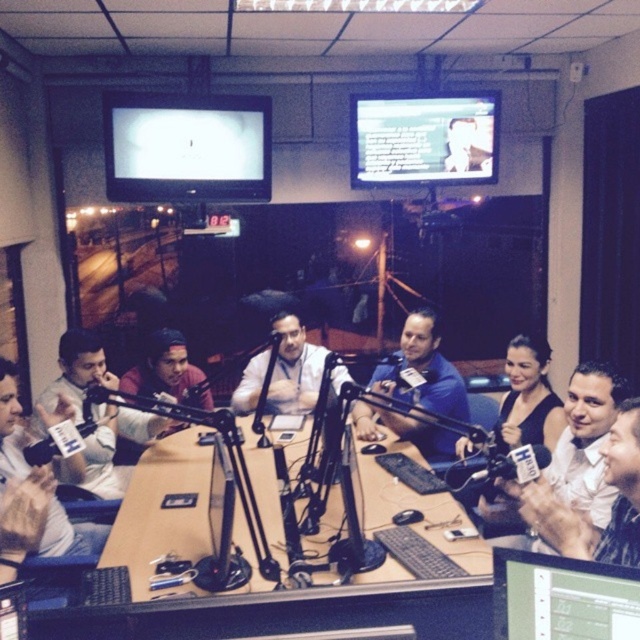
You are a technician in a studio and need to adjust the distance between the brown wooden table at center and the matte black monitor at upper left. The current distance is 5.07 feet. If the recommended distance for optimal viewing is 5 feet, is the current distance within the recommended range?

The brown wooden table at center is 5.07 feet from matte black monitor at upper left. Since 5.07 feet is slightly more than the recommended 5 feet, the current distance is just outside the recommended range. You may need to move the monitor closer to achieve optimal viewing distance.

You are a guest speaker entering the studio and need to place your notes on the brown wooden table at center. However, you notice the blue shirt at center is already occupying space above the table. Can you place your notes on the table without moving the shirt?

The brown wooden table at center is below blue shirt at center, so the shirt is above the table. Since the shirt is on top of the table, you cannot place your notes there without moving it.